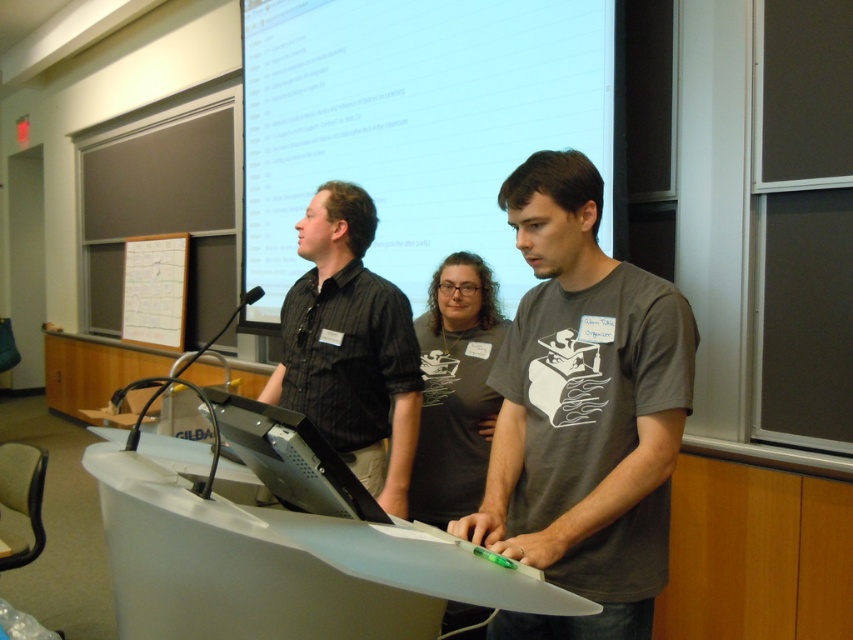
You are sitting in the classroom and want to determine which of the two points, point (439,109) or point (299,449), is closer to you. Based on the scene description, which point is nearer?

Point (439,109) is further to the viewer than point (299,449). Therefore, point (299,449) is closer to you.

You are a student sitting at the back of the classroom. You need to read the text on the white matte projection screen at upper center and the black glossy monitor at center. Which one do you think will be easier to read from your seat?

The white matte projection screen at upper center is larger in size than the black glossy monitor at center, so it will be easier to read from the back of the classroom.